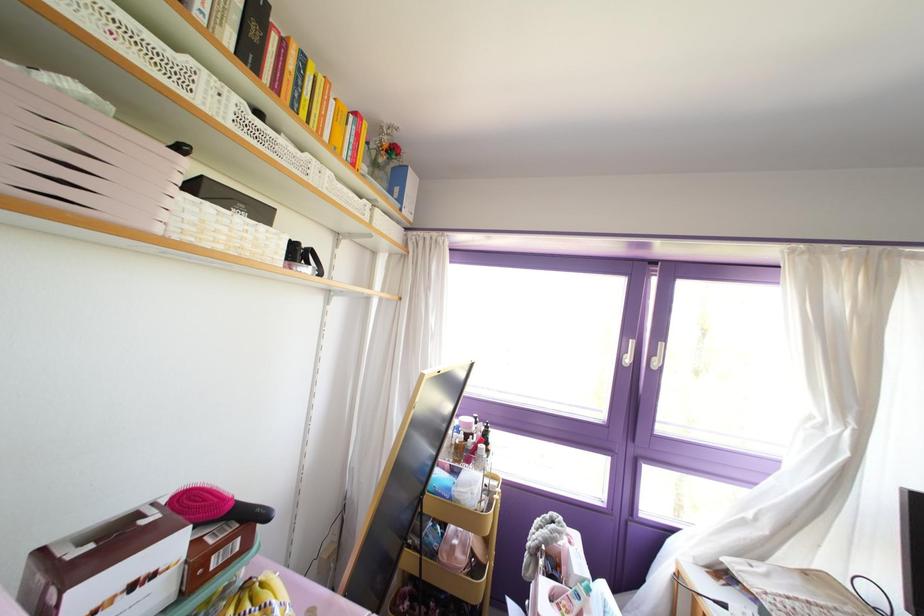
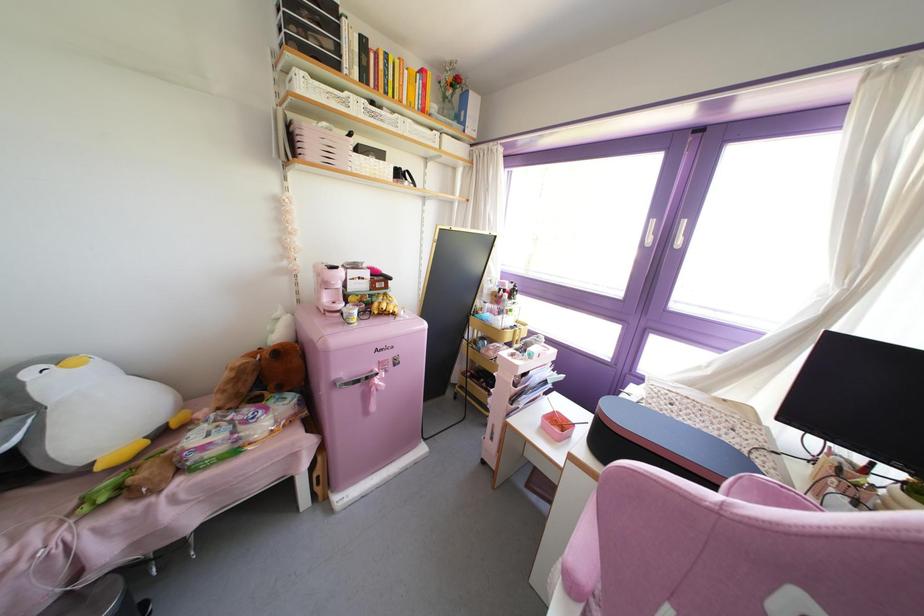
Locate, in the second image, the point that corresponds to point (237, 219) in the first image.

(371, 160)